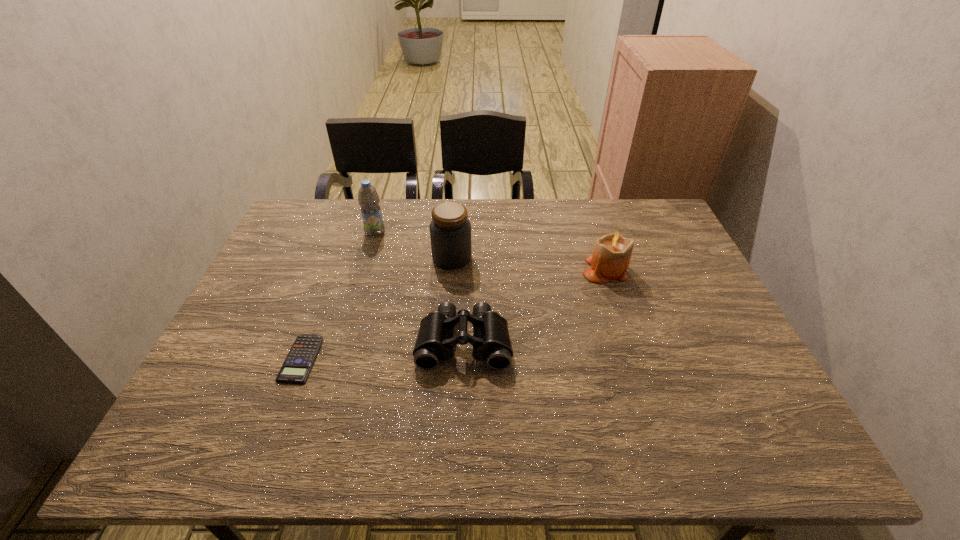
Find the location of a particular element. water bottle is located at coordinates (368, 198).

Identify the location of the farthest object. (368, 198).

The height and width of the screenshot is (540, 960). Identify the location of jar. (450, 231).

Locate an element on the screen. The width and height of the screenshot is (960, 540). the rightmost object is located at coordinates (612, 252).

Locate an element on the screen. The width and height of the screenshot is (960, 540). the third shortest object is located at coordinates (612, 252).

Identify the location of binoculars. The width and height of the screenshot is (960, 540). (435, 341).

The height and width of the screenshot is (540, 960). Find the location of `the leftmost object`. the leftmost object is located at coordinates (296, 368).

Identify the location of the shortest object. Image resolution: width=960 pixels, height=540 pixels. (296, 368).

I want to click on vacant region located 0.260m on the left of the second object from left to right, so click(283, 232).

The image size is (960, 540). What are the coordinates of `vacant space located on the surface of the jar near the warning symbol` in the screenshot? It's located at (529, 258).